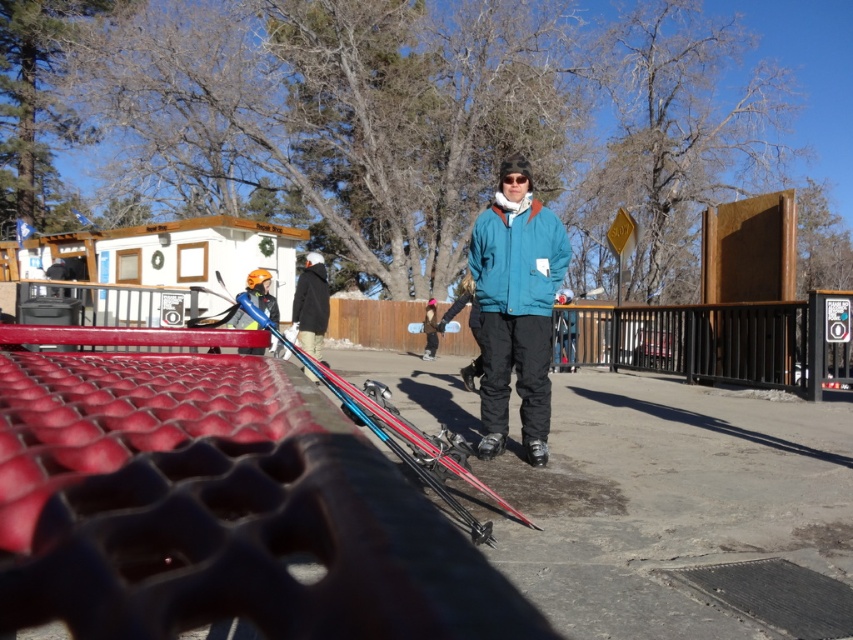
You are at a winter resort and want to move from the first point to the second point. Which direction should you move to go from point (x=514, y=225) to point (x=490, y=497)?

To move from point (x=514, y=225) to point (x=490, y=497), you should move towards the right and slightly forward since point (x=514, y=225) is behind point (x=490, y=497).